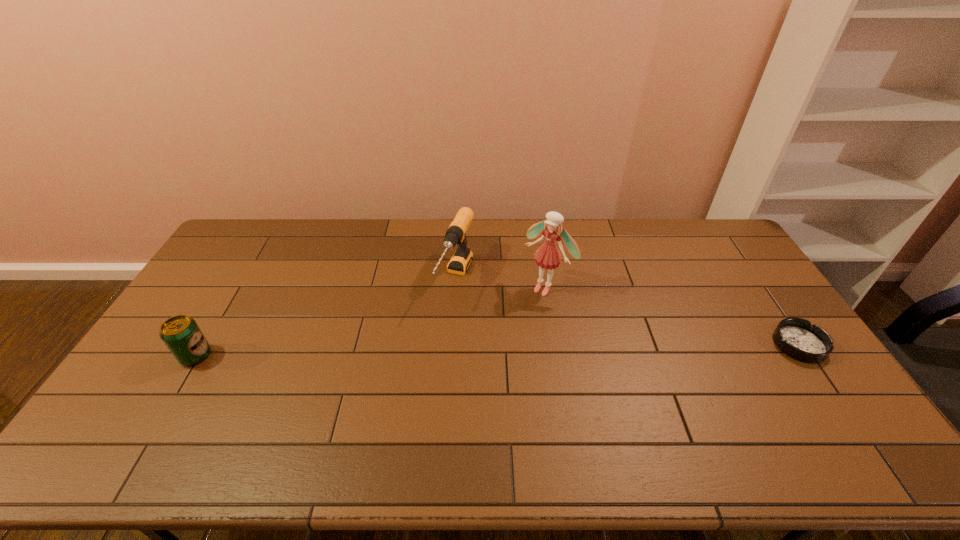
Identify the location of vacant space at the right edge of the desktop. (780, 380).

The image size is (960, 540). Find the location of `free space at the far right corner`. free space at the far right corner is located at coordinates (708, 255).

What are the coordinates of `vacant space at the near right corner of the desktop` in the screenshot? It's located at (798, 406).

At what (x,y) coordinates should I click in order to perform the action: click on empty space that is in between the second shortest object and the drill. Please return your answer as a coordinate pair (x, y). Looking at the image, I should click on (325, 317).

Locate an element on the screen. The width and height of the screenshot is (960, 540). free spot between the shortest object and the third object from left to right is located at coordinates (673, 316).

The image size is (960, 540). I want to click on vacant area that lies between the ashtray and the third object from left to right, so click(673, 316).

Find the location of a particular element. free space between the shortest object and the tallest object is located at coordinates (673, 316).

The height and width of the screenshot is (540, 960). What are the coordinates of `unoccupied area between the shortest object and the drill` in the screenshot? It's located at (628, 312).

Identify the location of free spot between the third object from right to left and the second object from right to left. The width and height of the screenshot is (960, 540). 501,282.

This screenshot has width=960, height=540. In order to click on free space between the tallest object and the second object from left to right in this screenshot , I will do `click(501, 282)`.